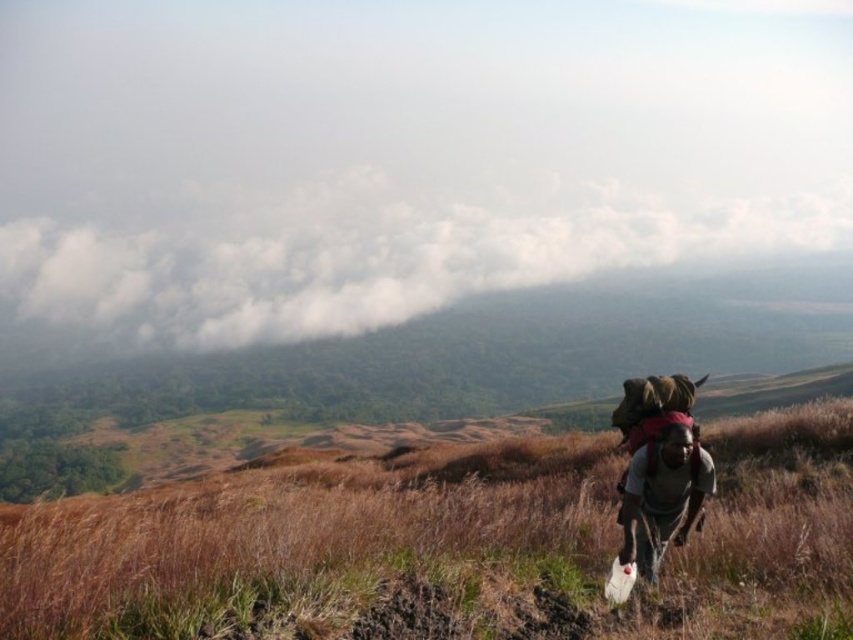
You are a hiker who wants to cross the field of brown dry grass at lower right while avoiding the gray fabric backpack at right. Which path should you take to stay above the backpack?

The brown dry grass at lower right is much taller than the gray fabric backpack at right, so you should walk through the brown dry grass at lower right to stay above the backpack.

You are standing in the field and see the brown dry grass at lower right and the white fluffy cloud at upper left. Which object is positioned more to the left side of the image?

The brown dry grass at lower right is positioned to the left of the white fluffy cloud at upper left, so the brown dry grass at lower right is more to the left.

In the scene shown: You are standing at the camera position and want to estimate how far the white fluffy cloud at upper left is from you. Can you determine the distance using the information provided?

The distance between the white fluffy cloud at upper left and the camera is 219.99 meters.